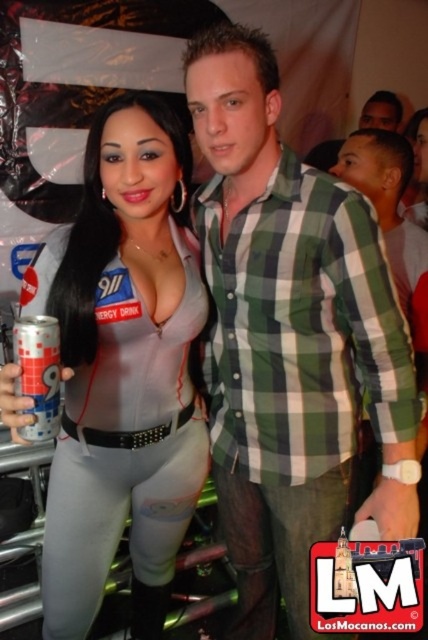
How much distance is there between green plaid shirt at center and smooth skin face at upper right?

green plaid shirt at center is 6.94 feet away from smooth skin face at upper right.

At what (x,y) coordinates should I click in order to perform the action: click on green plaid shirt at center. Please return your answer as a coordinate pair (x, y). The height and width of the screenshot is (640, 428). Looking at the image, I should click on (287, 332).

Locate an element on the screen. This screenshot has width=428, height=640. green plaid shirt at center is located at coordinates (287, 332).

Is green plaid shirt at center to the left of silver metallic can at left from the viewer's perspective?

No, green plaid shirt at center is not to the left of silver metallic can at left.

Is green plaid shirt at center taller than silver metallic can at left?

Yes.

Locate an element on the screen. green plaid shirt at center is located at coordinates (287, 332).

Does satin silver jumpsuit at center appear under smooth skin face at upper right?

Correct, satin silver jumpsuit at center is located below smooth skin face at upper right.

Is satin silver jumpsuit at center further to camera compared to smooth skin face at upper right?

No, it is in front of smooth skin face at upper right.

Does point (48, 266) come closer to viewer compared to point (385, 124)?

Yes, it is in front of point (385, 124).

At what (x,y) coordinates should I click in order to perform the action: click on satin silver jumpsuit at center. Please return your answer as a coordinate pair (x, y). Looking at the image, I should click on (122, 369).